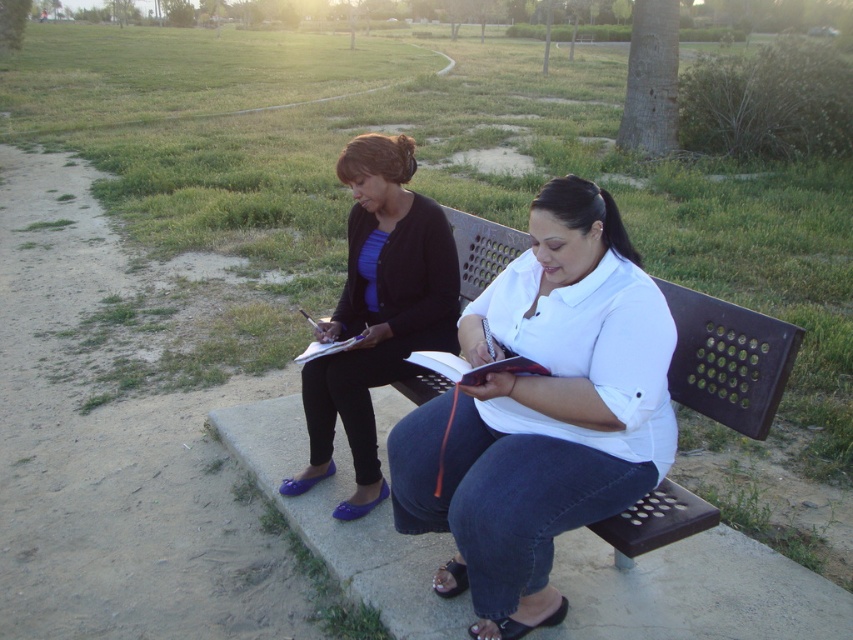
You are standing at the point with coordinates point (x=405, y=360) and want to walk to the point with coordinates point (x=289, y=493). According to the scene description, which direction should you move to reach your destination?

Point (x=289, y=493) is behind point (x=405, y=360), so you should move backward to reach your destination.

You are a photographer planning to take a portrait of both the white matte shirt at center and the red leather journal at center. Since you want to ensure both are clearly visible in the frame, which object should you prioritize positioning closer to the camera to maintain detail?

The white matte shirt at center should be positioned closer to the camera because its width is larger than the red leather journal at center, so it requires more space to capture all details clearly.